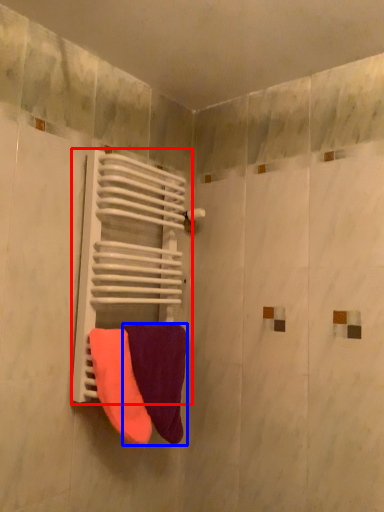
Question: Which of the following is the closest to the observer, radiator (highlighted by a red box) or towel (highlighted by a blue box)?

Choices:
 (A) radiator
 (B) towel

Answer: (A)